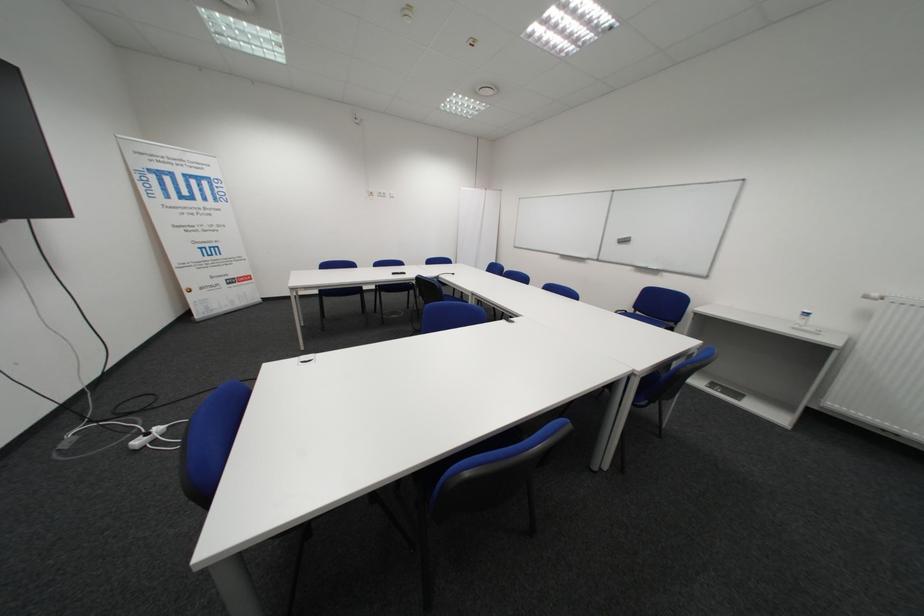
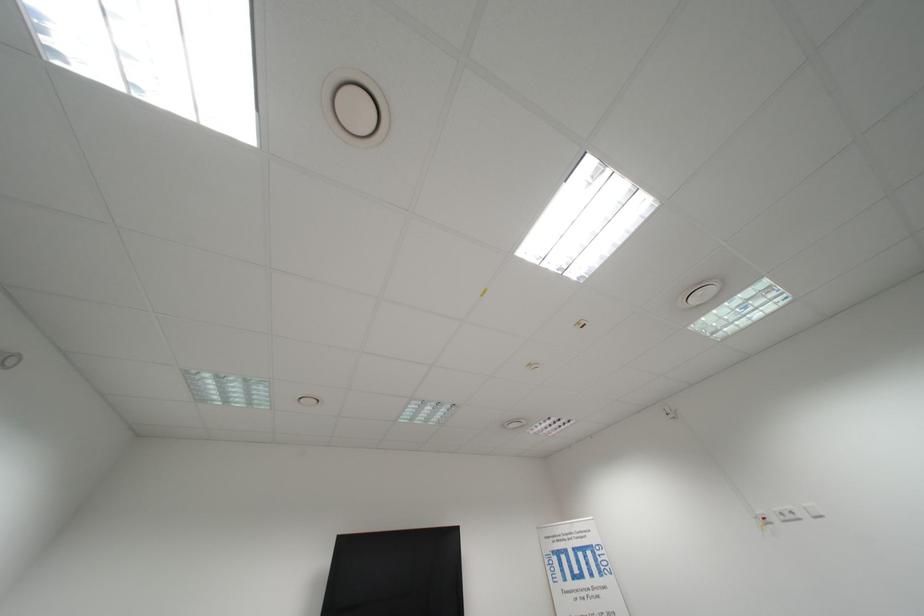
The point at [402,195] is marked in the first image. Where is the corresponding point in the second image?

(818, 509)